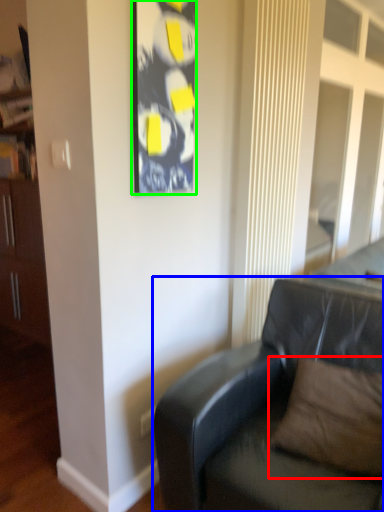
Question: Which object is positioned farthest from pillow (highlighted by a red box)? Select from studio couch (highlighted by a blue box) and picture frame (highlighted by a green box).

Choices:
 (A) studio couch
 (B) picture frame

Answer: (B)